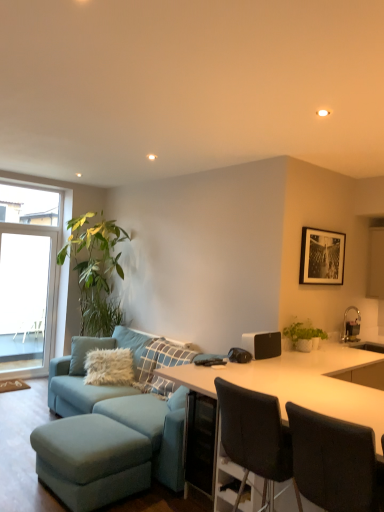
Question: Should I look upward or downward to see green matte plant at right?

Choices:
 (A) down
 (B) up

Answer: (A)

Question: Is green matte plant at right to the right of transparent glass window at left from the viewer's perspective?

Choices:
 (A) yes
 (B) no

Answer: (A)

Question: Is transparent glass window at left a part of green matte plant at right?

Choices:
 (A) no
 (B) yes

Answer: (A)

Question: Would you say green matte plant at right is outside transparent glass window at left?

Choices:
 (A) no
 (B) yes

Answer: (B)

Question: Is the depth of green matte plant at right greater than that of transparent glass window at left?

Choices:
 (A) yes
 (B) no

Answer: (B)

Question: From the image's perspective, does green matte plant at right appear higher than transparent glass window at left?

Choices:
 (A) no
 (B) yes

Answer: (A)

Question: Is green matte plant at right not near transparent glass window at left?

Choices:
 (A) yes
 (B) no

Answer: (A)

Question: Does black paper at upper center have a greater height compared to white glossy desk at center?

Choices:
 (A) no
 (B) yes

Answer: (A)

Question: Is there a large distance between black paper at upper center and white glossy desk at center?

Choices:
 (A) no
 (B) yes

Answer: (B)

Question: Considering the relative sizes of black paper at upper center and white glossy desk at center in the image provided, is black paper at upper center bigger than white glossy desk at center?

Choices:
 (A) no
 (B) yes

Answer: (A)

Question: Can you confirm if black paper at upper center is thinner than white glossy desk at center?

Choices:
 (A) yes
 (B) no

Answer: (A)

Question: Can you confirm if black paper at upper center is wider than white glossy desk at center?

Choices:
 (A) no
 (B) yes

Answer: (A)

Question: From a real-world perspective, does black paper at upper center stand above white glossy desk at center?

Choices:
 (A) yes
 (B) no

Answer: (A)

Question: Is the position of black paper at upper center more distant than that of matte blue ottoman at lower left?

Choices:
 (A) yes
 (B) no

Answer: (A)